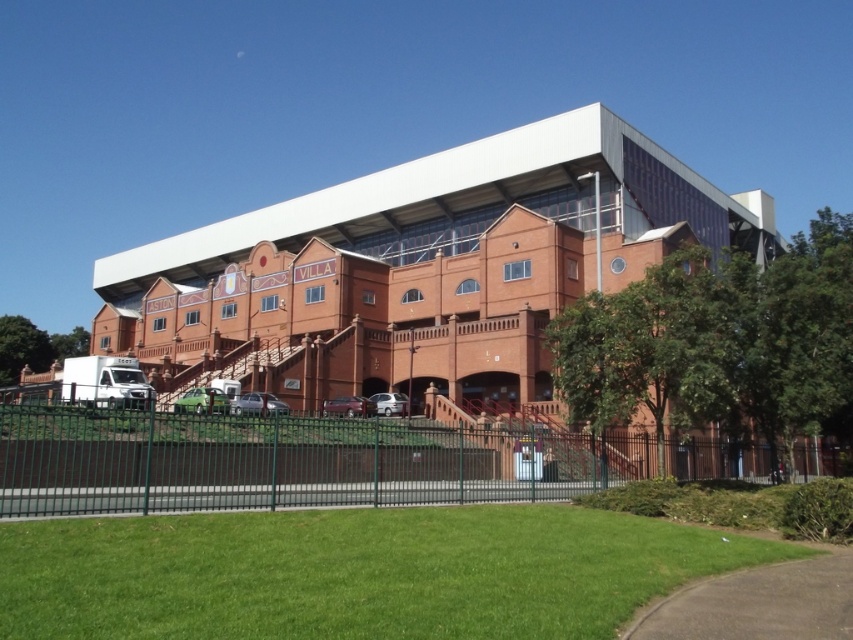
Who is higher up, green grass at lower center or green metal fence at lower center?

green metal fence at lower center

What do you see at coordinates (355, 572) in the screenshot? This screenshot has height=640, width=853. I see `green grass at lower center` at bounding box center [355, 572].

In order to click on green grass at lower center in this screenshot , I will do [x=355, y=572].